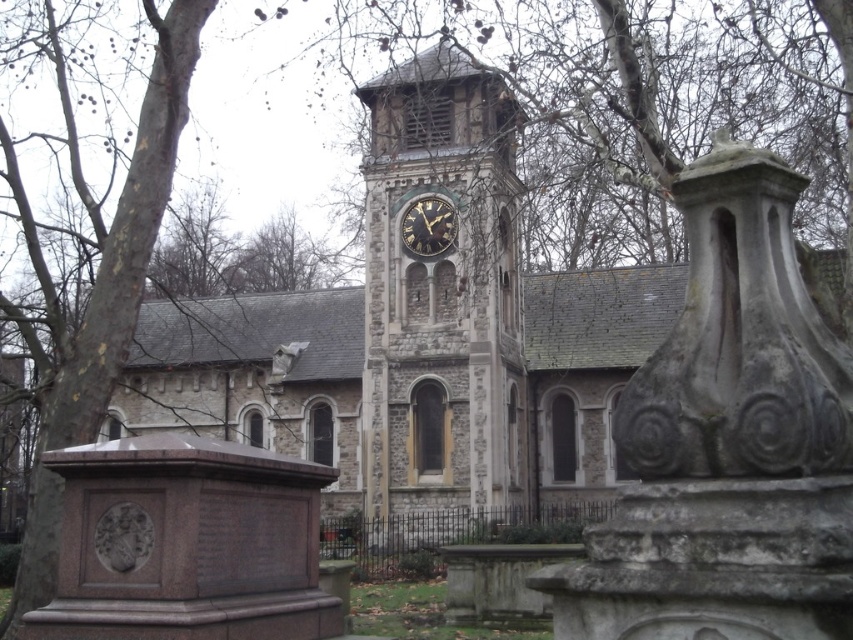
You are an architect visiting the historic church and want to compare the two stone structures in the image. Which one is bigger between the stone clock tower at center and the dark gray stone clock at center?

The stone clock tower at center is larger in size than the dark gray stone clock at center.

You are standing in front of the historic stone church and want to take a photo that includes both the stone clock tower at center and the dark gray stone clock at center. Which object should you focus on first to ensure both are in the frame?

You should focus on the stone clock tower at center first because it is taller than the dark gray stone clock at center, so it will occupy more space in the photo and help frame both objects properly.

You are standing in front of the historic stone church and want to take a photo of both the stone clock tower at center and the dark gray stone clock at center. Which one should you focus on first to ensure both are in clear view?

You should focus on the stone clock tower at center first because it is closer to you than the dark gray stone clock at center, so adjusting focus from near to far will help both be in clear view.